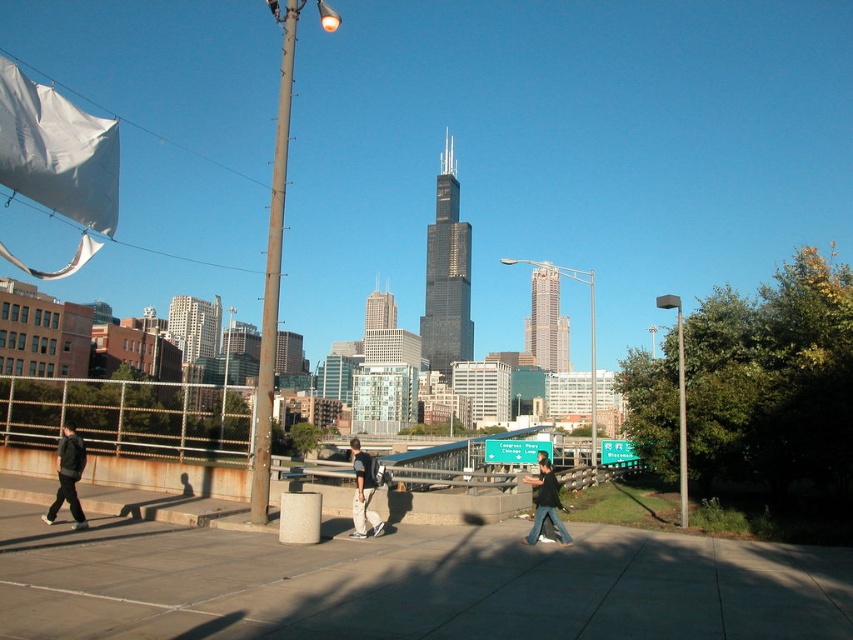
How distant is gray glass skyscraper at center from dark gray hoodie at center?

gray glass skyscraper at center and dark gray hoodie at center are 341.58 meters apart.

Measure the distance from gray glass skyscraper at center to dark gray hoodie at center.

1120.67 feet

This screenshot has height=640, width=853. What do you see at coordinates (546, 323) in the screenshot?
I see `gray glass skyscraper at center` at bounding box center [546, 323].

Find the location of a particular element. gray glass skyscraper at center is located at coordinates (546, 323).

Does black glass skyscraper at center have a smaller size compared to dark gray hoodie at center?

No.

Which is above, black glass skyscraper at center or dark gray hoodie at center?

black glass skyscraper at center

You are a GUI agent. You are given a task and a screenshot of the screen. Output one action in this format:
    pyautogui.click(x=<x>, y=<y>)
    Task: Click on the black glass skyscraper at center
    The width and height of the screenshot is (853, 640).
    Given the screenshot: What is the action you would take?
    click(x=445, y=275)

Between gray concrete sidewalk at center and dark gray hoodie at center, which one appears on the left side from the viewer's perspective?

gray concrete sidewalk at center

Does gray concrete sidewalk at center have a larger size compared to dark gray hoodie at center?

Indeed, gray concrete sidewalk at center has a larger size compared to dark gray hoodie at center.

The width and height of the screenshot is (853, 640). Describe the element at coordinates (415, 586) in the screenshot. I see `gray concrete sidewalk at center` at that location.

Identify the location of gray concrete sidewalk at center. This screenshot has height=640, width=853. (415, 586).